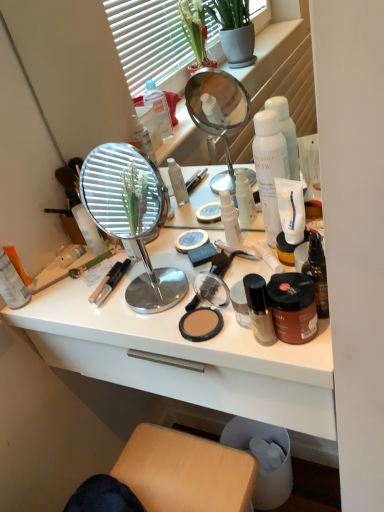
Where is `free location to the left of white matte pump bottle at center, the 2th toiletry positioned from the left`? This screenshot has height=512, width=384. free location to the left of white matte pump bottle at center, the 2th toiletry positioned from the left is located at coordinates (154, 270).